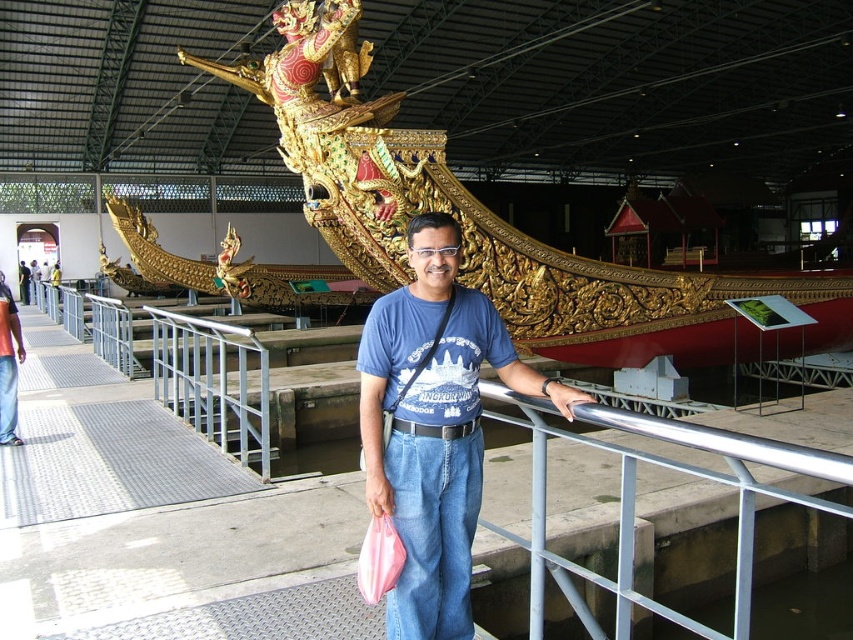
Question: Is metal/rail at center bigger than gold/gilded wood boat at center?

Choices:
 (A) yes
 (B) no

Answer: (B)

Question: Which of these objects is positioned farthest from the metal/rail at center?

Choices:
 (A) gold/gilded wood boat at center
 (B) blue cotton t-shirt at center

Answer: (A)

Question: Which of the following is the farthest from the observer?

Choices:
 (A) (378, 474)
 (B) (515, 586)

Answer: (B)

Question: In this image, where is gold/gilded wood boat at center located relative to blue cotton t-shirt at center?

Choices:
 (A) left
 (B) right

Answer: (A)

Question: Which object appears closest to the camera in this image?

Choices:
 (A) gold/gilded wood boat at center
 (B) metal/rail at center

Answer: (B)

Question: Is metal/rail at center to the left of gold/gilded wood boat at center from the viewer's perspective?

Choices:
 (A) yes
 (B) no

Answer: (A)